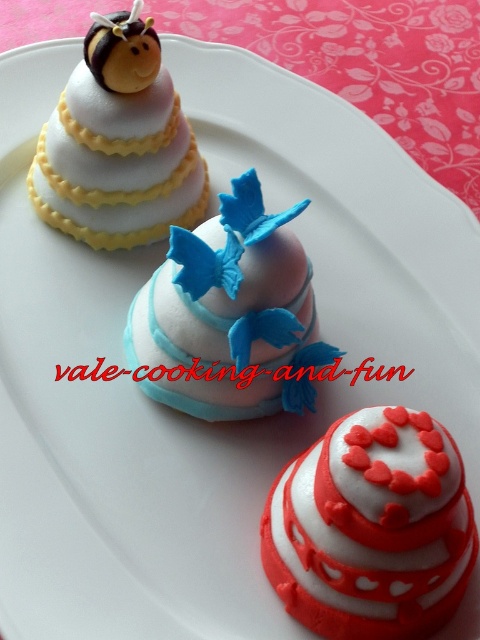
Identify the location of smooth white and red fondant cake at center. The width and height of the screenshot is (480, 640). (372, 529).

The height and width of the screenshot is (640, 480). I want to click on smooth white and red fondant cake at center, so click(x=372, y=529).

Locate an element on the screen. The height and width of the screenshot is (640, 480). smooth white and red fondant cake at center is located at coordinates (372, 529).

Describe the element at coordinates (230, 310) in the screenshot. The height and width of the screenshot is (640, 480). I see `matte pink fondant cake at center` at that location.

Who is positioned more to the right, matte pink fondant cake at center or matte white fondant cake at upper left?

From the viewer's perspective, matte pink fondant cake at center appears more on the right side.

Who is more forward, (226, 228) or (142, 176)?

Positioned in front is point (226, 228).

Where is `matte pink fondant cake at center`? matte pink fondant cake at center is located at coordinates (230, 310).

The height and width of the screenshot is (640, 480). Describe the element at coordinates (372, 529) in the screenshot. I see `smooth white and red fondant cake at center` at that location.

Is the position of smooth white and red fondant cake at center more distant than that of matte white fondant cake at upper left?

That is False.

Where is `smooth white and red fondant cake at center`? smooth white and red fondant cake at center is located at coordinates pyautogui.click(x=372, y=529).